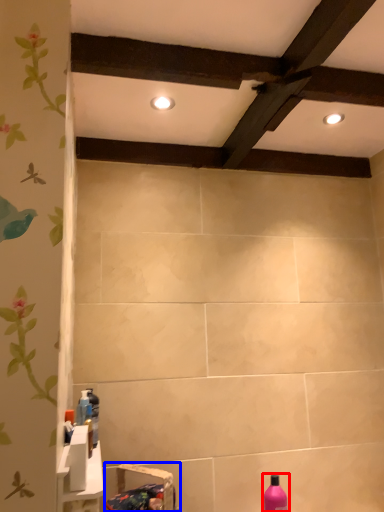
Question: Among these objects, which one is nearest to the camera, bottle (highlighted by a red box) or sink (highlighted by a blue box)?

Choices:
 (A) bottle
 (B) sink

Answer: (B)